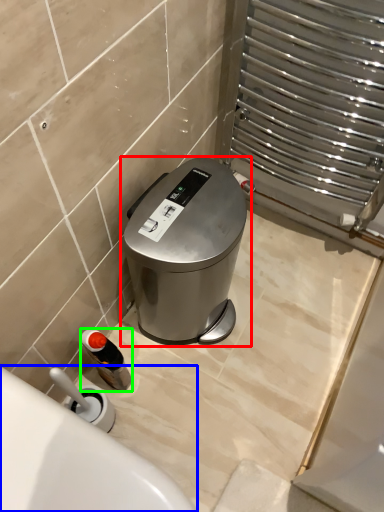
Question: Considering the real-world distances, which object is farthest from waste container (highlighted by a red box)? bath (highlighted by a blue box) or bottle (highlighted by a green box)?

Choices:
 (A) bath
 (B) bottle

Answer: (A)